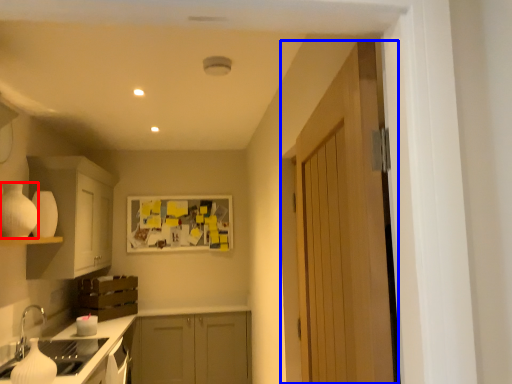
Question: Which of the following is the closest to the observer, appliance (highlighted by a red box) or door (highlighted by a blue box)?

Choices:
 (A) appliance
 (B) door

Answer: (B)